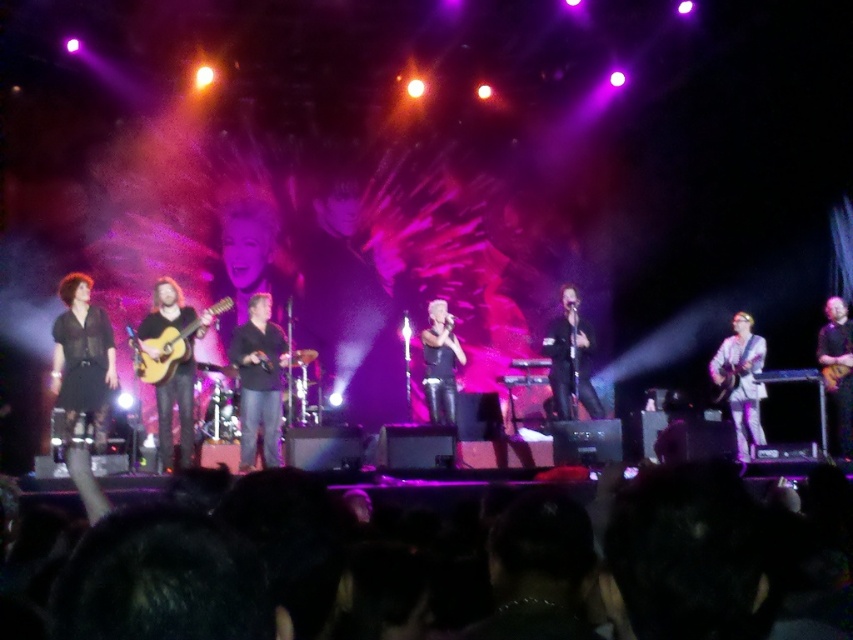
Question: Which point is farther to the camera?

Choices:
 (A) black leather pants at center
 (B) white glossy guitar at right

Answer: (A)

Question: Can you confirm if black matte microphone at center is positioned below black leather guitar at right?

Choices:
 (A) no
 (B) yes

Answer: (A)

Question: Estimate the real-world distances between objects in this image. Which object is farther from the black leather guitar at right?

Choices:
 (A) black matte microphone at center
 (B) white glossy guitar at right
 (C) black leather pants at center

Answer: (C)

Question: Which of the following is the farthest from the observer?

Choices:
 (A) (839, 305)
 (B) (59, 344)

Answer: (A)

Question: Where is black matte shirt at left located in relation to black matte shirt at center in the image?

Choices:
 (A) left
 (B) right

Answer: (A)

Question: Does black leather pants at center appear over light brown wooden guitar at center?

Choices:
 (A) yes
 (B) no

Answer: (B)